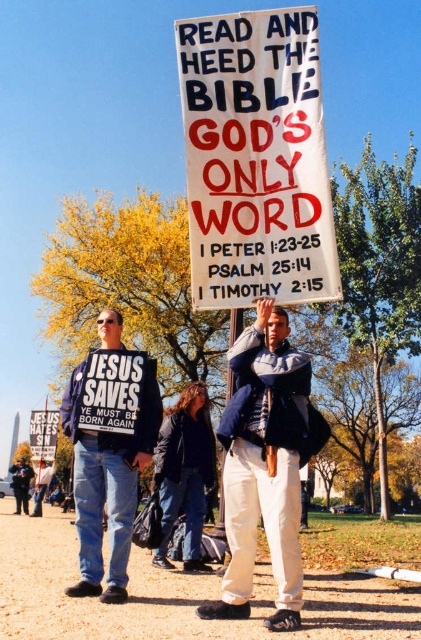
Question: Considering the real-world distances, which object is farthest from the white paper sign at center?

Choices:
 (A) black cotton shirt at center
 (B) denim jacket at center
 (C) dark blue jacket at center

Answer: (C)

Question: Which object is closer to the camera taking this photo?

Choices:
 (A) denim jacket at center
 (B) black cotton shirt at center
 (C) white paper sign at center
 (D) dark blue jacket at center

Answer: (A)

Question: Which is nearer to the dark blue jacket at center?

Choices:
 (A) black cotton shirt at center
 (B) denim jacket at center

Answer: (A)

Question: Can you confirm if white paper sign at center is thinner than denim jacket at center?

Choices:
 (A) yes
 (B) no

Answer: (A)

Question: Is denim jacket at center further to the viewer compared to black cotton shirt at center?

Choices:
 (A) no
 (B) yes

Answer: (A)

Question: Considering the relative positions of denim jacket at center and black cotton shirt at center in the image provided, where is denim jacket at center located with respect to black cotton shirt at center?

Choices:
 (A) left
 (B) right

Answer: (B)